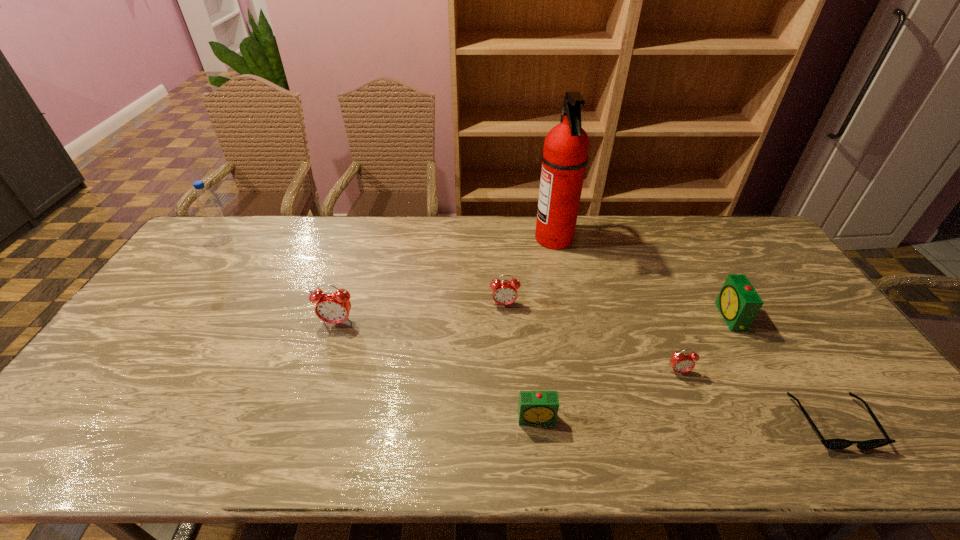
This screenshot has height=540, width=960. Find the location of `object that is the fifth closest to the leftmost red alarm clock`. object that is the fifth closest to the leftmost red alarm clock is located at coordinates (681, 362).

Identify which alarm clock is located as the fifth nearest to the shortest object. Please provide its 2D coordinates. Your answer should be formatted as a tuple, i.e. [(x, y)], where the tuple contains the x and y coordinates of a point satisfying the conditions above.

[(332, 307)]

Point out which alarm clock is positioned as the nearest to the black sunglasses. Please provide its 2D coordinates. Your answer should be formatted as a tuple, i.e. [(x, y)], where the tuple contains the x and y coordinates of a point satisfying the conditions above.

[(738, 302)]

Locate an element on the screen. The height and width of the screenshot is (540, 960). red alarm clock that is the closest to the fourth farthest alarm clock is located at coordinates (504, 292).

Find the location of a particular element. red alarm clock that is the second closest one to the leftmost object is located at coordinates (504, 292).